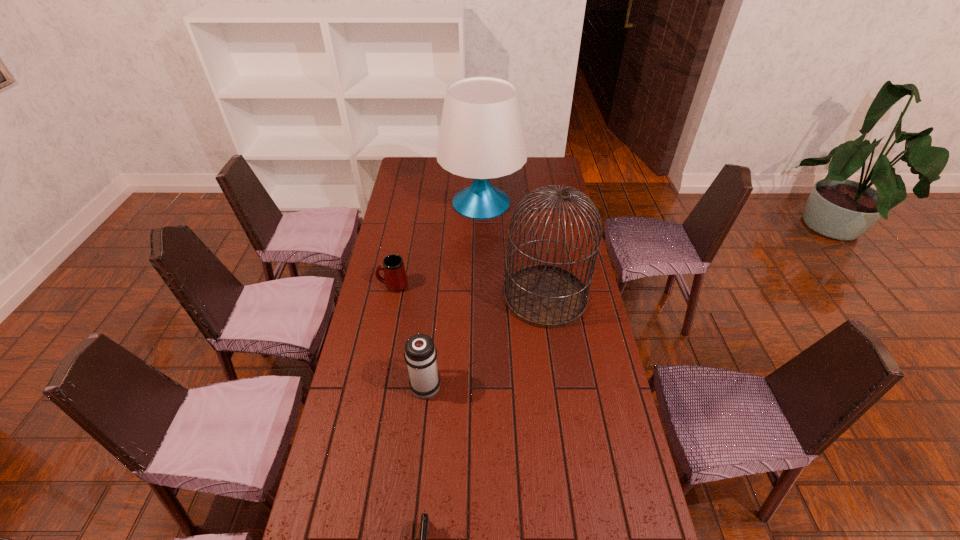
Image resolution: width=960 pixels, height=540 pixels. Find the location of `table lamp`. table lamp is located at coordinates (481, 136).

In order to click on birdcage in this screenshot , I will do `click(545, 296)`.

Find the location of a particular element. thermos bottle is located at coordinates (420, 354).

Identify the location of the fourth farthest object. (420, 354).

Locate an element on the screen. This screenshot has height=540, width=960. mug is located at coordinates (395, 278).

The height and width of the screenshot is (540, 960). Find the location of `the leftmost object`. the leftmost object is located at coordinates (395, 278).

Where is `blank space located 0.110m on the front-facing side of the farthest object`? The height and width of the screenshot is (540, 960). blank space located 0.110m on the front-facing side of the farthest object is located at coordinates (482, 244).

Where is `free space located 0.110m on the front of the birdcage`? The width and height of the screenshot is (960, 540). free space located 0.110m on the front of the birdcage is located at coordinates (554, 354).

Locate an element on the screen. This screenshot has width=960, height=540. vacant space situated 0.300m on the side with the handle of the third tallest object is located at coordinates (434, 302).

Where is `free space located on the side with the handle of the third tallest object`? free space located on the side with the handle of the third tallest object is located at coordinates (431, 333).